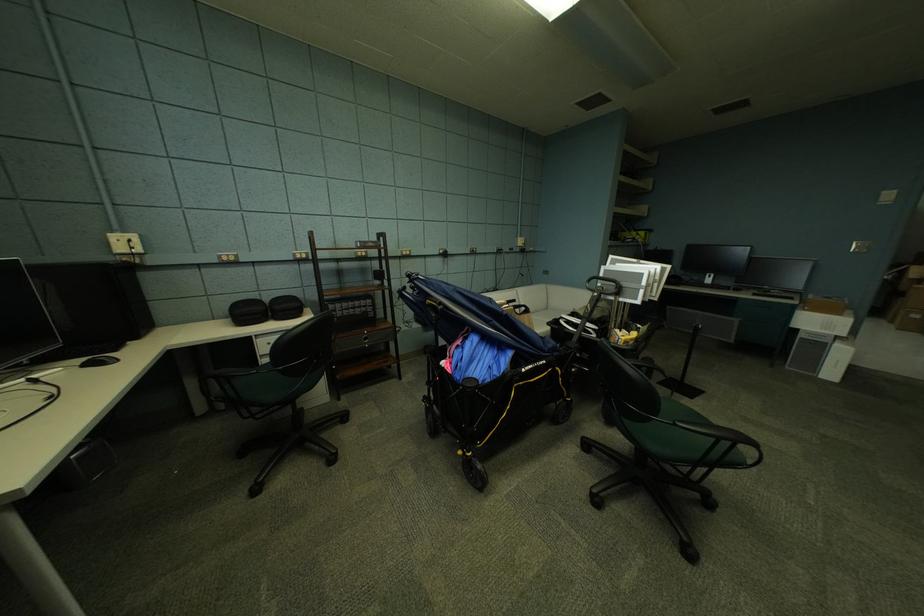
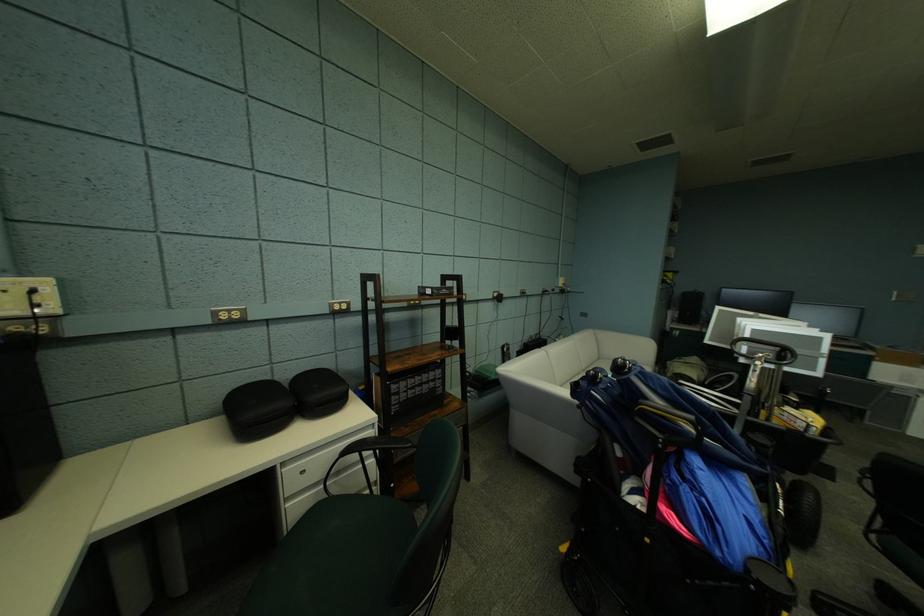
What movement of the cameraman would produce the second image?

The cameraman moved toward left, forward.